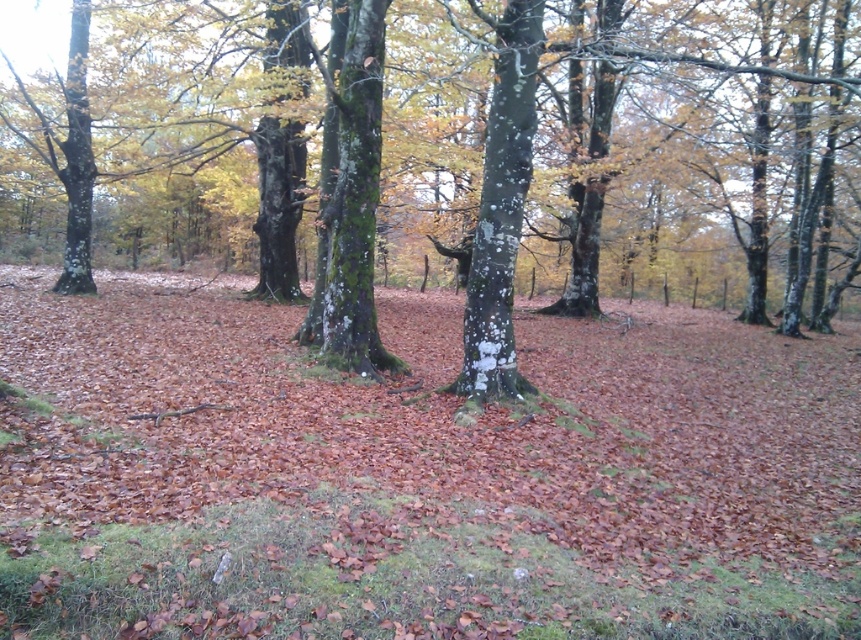
Which is above, green mossy tree at center or green mossy tree trunk at center?

green mossy tree at center

Who is more forward, (736,68) or (367,58)?

Point (736,68) is more forward.

At what (x,y) coordinates should I click in order to perform the action: click on green mossy tree at center. Please return your answer as a coordinate pair (x, y). Image resolution: width=861 pixels, height=640 pixels. Looking at the image, I should click on (574, 156).

Who is more forward, (383,208) or (478,337)?

Positioned in front is point (478,337).

Is green mossy tree at center above white lichen-covered tree trunk at center?

Indeed, green mossy tree at center is positioned over white lichen-covered tree trunk at center.

Who is more distant from viewer, [438,68] or [500,234]?

Positioned behind is point [438,68].

This screenshot has width=861, height=640. Identify the location of green mossy tree at center. (574, 156).

Can you confirm if brown matte leaves at center is smaller than green mossy tree at center?

Correct, brown matte leaves at center occupies less space than green mossy tree at center.

Is brown matte leaves at center below green mossy tree at center?

Yes, brown matte leaves at center is below green mossy tree at center.

What do you see at coordinates (417, 474) in the screenshot? The height and width of the screenshot is (640, 861). I see `brown matte leaves at center` at bounding box center [417, 474].

Identify the location of brown matte leaves at center. This screenshot has height=640, width=861. (417, 474).